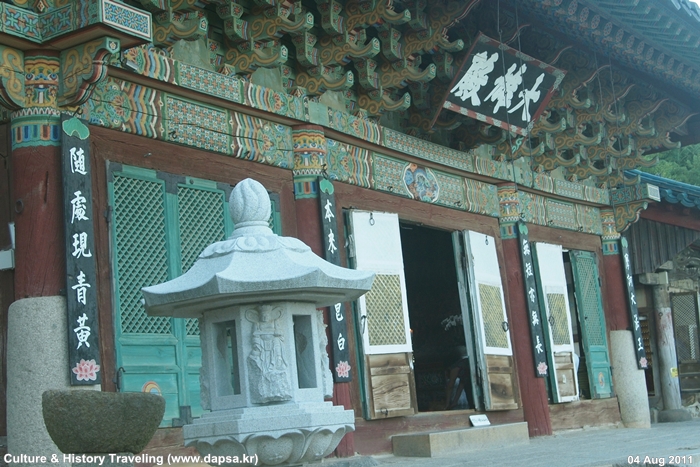
The image size is (700, 467). I want to click on black signs on wall, so click(635, 299), click(530, 315), click(340, 313), click(89, 284).